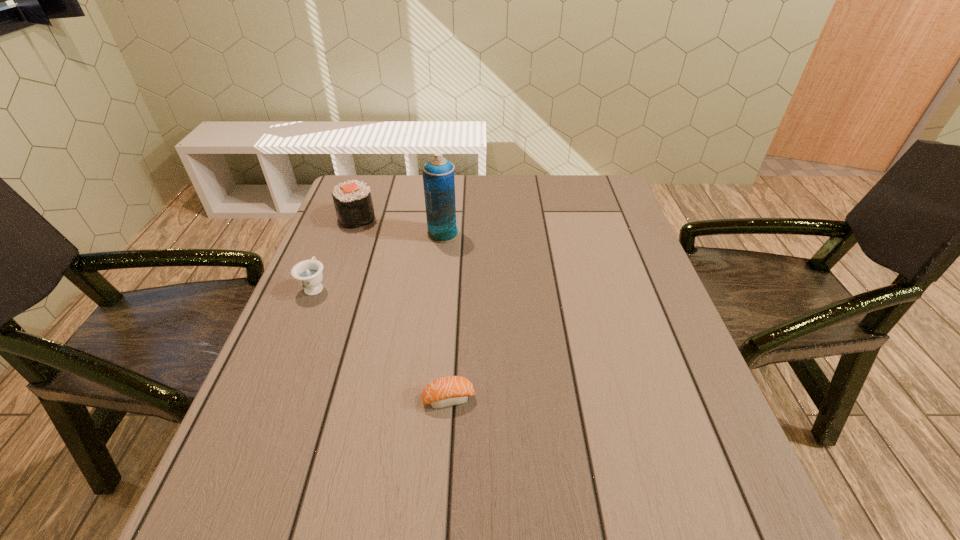
Identify the location of vacant space that is in between the left sushi and the nearer sushi. The height and width of the screenshot is (540, 960). (403, 308).

Locate an element on the screen. The width and height of the screenshot is (960, 540). free space that is in between the third farthest object and the aerosol can is located at coordinates (379, 260).

Image resolution: width=960 pixels, height=540 pixels. Identify the location of free space between the second tallest object and the tallest object. (400, 226).

Locate an element on the screen. The height and width of the screenshot is (540, 960). free space between the nearer sushi and the teacup is located at coordinates coord(382,342).

You are a GUI agent. You are given a task and a screenshot of the screen. Output one action in this format:
    pyautogui.click(x=<x>, y=<y>)
    Task: Click on the object that is the closest to the right sushi
    The image size is (960, 540).
    Given the screenshot: What is the action you would take?
    pyautogui.click(x=308, y=273)

What are the coordinates of `object that is the closest one to the third farthest object` in the screenshot? It's located at (353, 203).

The image size is (960, 540). Identify the location of free location that satisfies the following two spatial constraints: 1. on the front side of the taller sushi; 2. on the left side of the aerosol can. (351, 234).

At what (x,y) coordinates should I click in order to perform the action: click on free space that satisfies the following two spatial constraints: 1. on the front side of the aerosol can; 2. on the left side of the nearest object. Please return your answer as a coordinate pair (x, y). This screenshot has height=540, width=960. Looking at the image, I should click on (426, 398).

Identify the location of free space that satisfies the following two spatial constraints: 1. on the front side of the farther sushi; 2. on the right side of the nearer sushi. The image size is (960, 540). (292, 398).

Where is `vacant region that satisfies the following two spatial constraints: 1. on the side of the farther sushi with the handle; 2. on the right side of the second nearest object`? This screenshot has height=540, width=960. vacant region that satisfies the following two spatial constraints: 1. on the side of the farther sushi with the handle; 2. on the right side of the second nearest object is located at coordinates (343, 218).